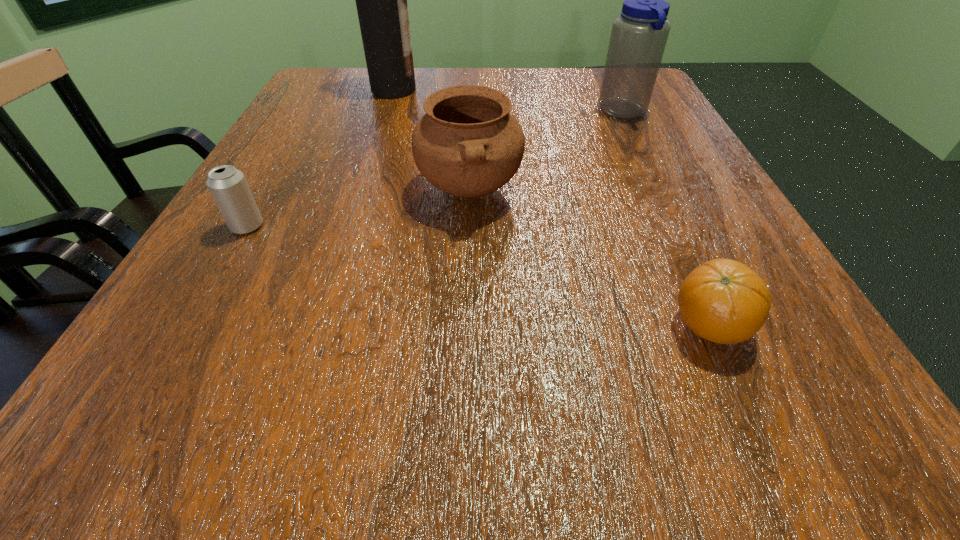
What are the coordinates of `vacant area situated 0.190m with a carrying loop on the side of the water bottle` in the screenshot? It's located at (509, 112).

What are the coordinates of `blank space located 0.180m on the left of the third object from left to right` in the screenshot? It's located at (310, 190).

Locate an element on the screen. The image size is (960, 540). vacant point located 0.380m on the back of the beer can is located at coordinates click(x=316, y=107).

This screenshot has height=540, width=960. Identify the location of vacant space situated 0.060m on the left of the nearest object. (621, 326).

Find the location of a particular element. The height and width of the screenshot is (540, 960). wine bottle at the far edge is located at coordinates (381, 0).

Locate an element on the screen. This screenshot has width=960, height=540. water bottle that is at the far edge is located at coordinates (639, 35).

Where is `wine bottle present at the left edge`? The height and width of the screenshot is (540, 960). wine bottle present at the left edge is located at coordinates point(381,0).

Locate an element on the screen. Image resolution: width=960 pixels, height=540 pixels. beer can present at the left edge is located at coordinates (228, 186).

This screenshot has width=960, height=540. Find the location of `water bottle that is at the right edge`. water bottle that is at the right edge is located at coordinates (639, 35).

Find the location of `orange that is positioned at the right edge`. orange that is positioned at the right edge is located at coordinates (724, 301).